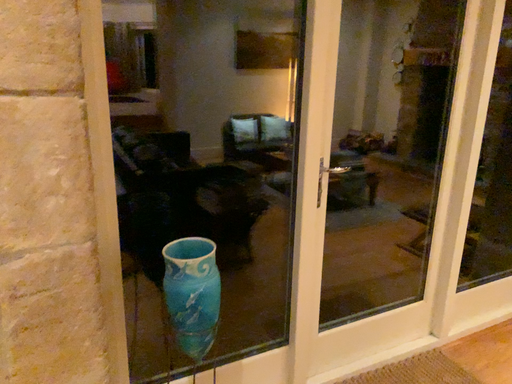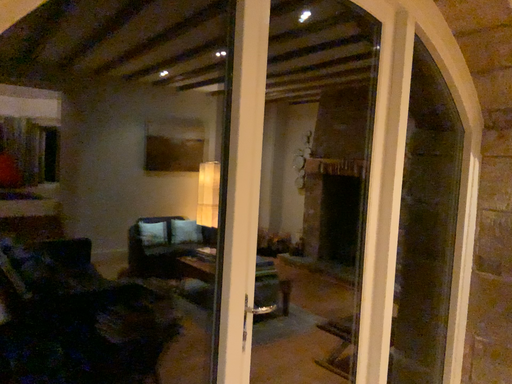
Question: How did the camera likely rotate when shooting the video?

Choices:
 (A) rotated downward
 (B) rotated upward

Answer: (B)